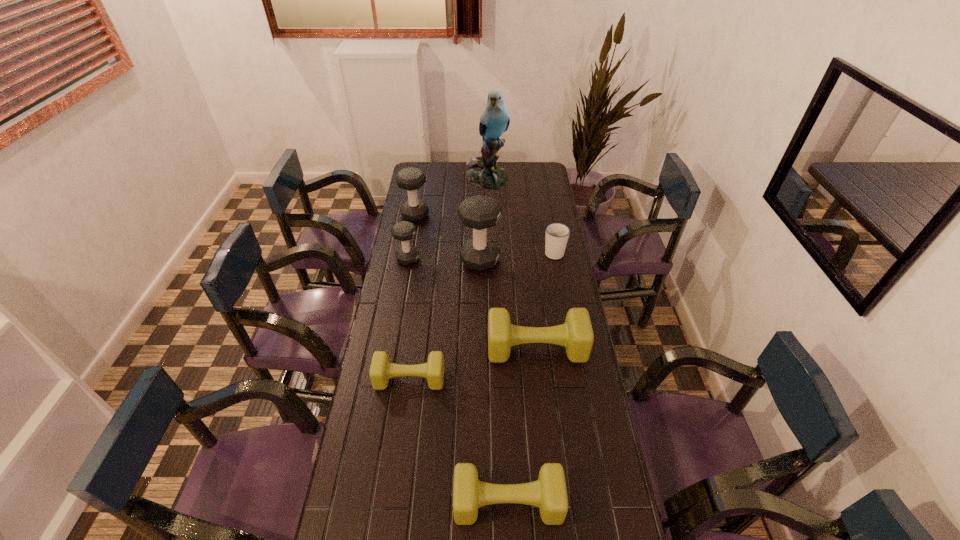
Locate an element on the screen. free spot at the far left corner of the desktop is located at coordinates (419, 166).

Identify the location of free space between the parakeet and the leftmost olive dumbbell. Image resolution: width=960 pixels, height=540 pixels. (448, 278).

Identify the location of vacant region between the fifth farthest dumbbell and the farthest olive dumbbell. The image size is (960, 540). (473, 363).

Locate an element on the screen. Image resolution: width=960 pixels, height=540 pixels. free space between the white cup and the parakeet is located at coordinates (520, 215).

Locate an element on the screen. The height and width of the screenshot is (540, 960). unoccupied position between the biggest olive dumbbell and the parakeet is located at coordinates (512, 263).

Identify the location of unoccupied position between the farthest olive dumbbell and the shortest dumbbell. The width and height of the screenshot is (960, 540). (473, 363).

At what (x,y) coordinates should I click in order to perform the action: click on empty space between the smallest gray dumbbell and the fifth tallest dumbbell. Please return your answer as a coordinate pair (x, y). Image resolution: width=960 pixels, height=540 pixels. Looking at the image, I should click on (458, 381).

Locate an element on the screen. The image size is (960, 540). vacant region between the tallest dumbbell and the fifth shortest dumbbell is located at coordinates coord(447,238).

Find the location of `object that is the fourth closest to the biggest gray dumbbell`. object that is the fourth closest to the biggest gray dumbbell is located at coordinates (576, 335).

The image size is (960, 540). Find the location of `object that ranks as the third closest to the nearest object`. object that ranks as the third closest to the nearest object is located at coordinates (479, 212).